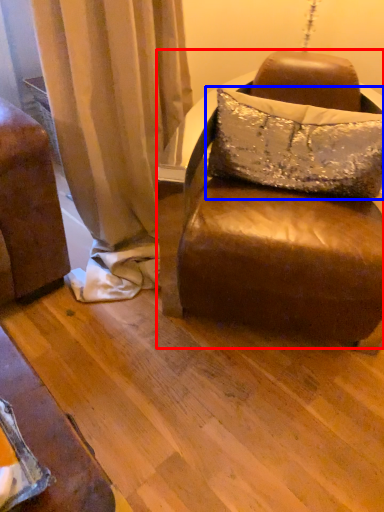
Question: Which object appears farthest to the camera in this image, studio couch (highlighted by a red box) or pillow (highlighted by a blue box)?

Choices:
 (A) studio couch
 (B) pillow

Answer: (B)